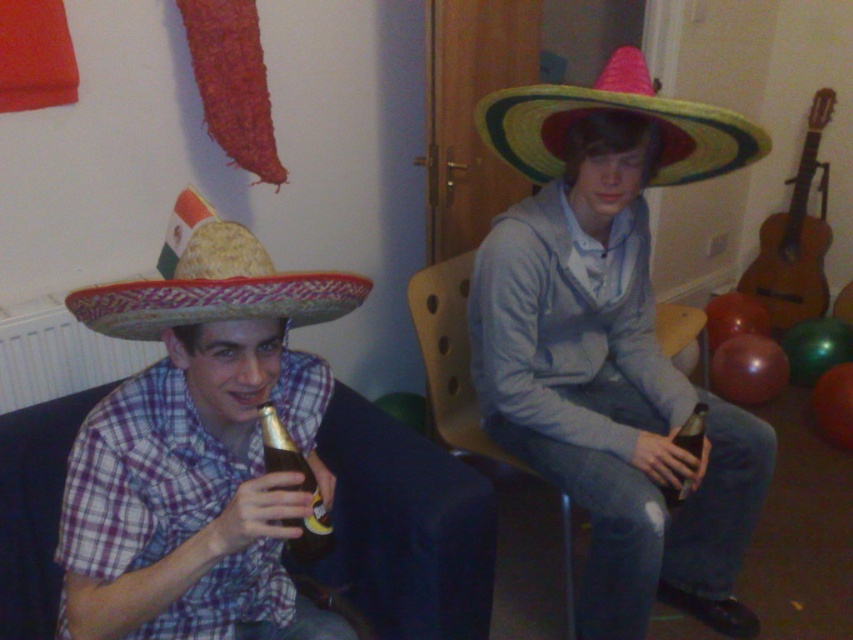
Measure the distance between point [143,301] and camera.

Point [143,301] is 34.87 inches from camera.

Can you confirm if strawhat at left is positioned to the left of multicolored straw sombrero at upper right?

Indeed, strawhat at left is positioned on the left side of multicolored straw sombrero at upper right.

Locate an element on the screen. The width and height of the screenshot is (853, 640). strawhat at left is located at coordinates (212, 282).

The width and height of the screenshot is (853, 640). Identify the location of strawhat at left. (212, 282).

Who is more forward, (607, 493) or (308, 541)?

Positioned in front is point (308, 541).

Is matte gray hoodie at center positioned before brown glass bottle at lower left?

No, matte gray hoodie at center is further to the viewer.

At what (x,y) coordinates should I click in order to perform the action: click on matte gray hoodie at center. Please return your answer as a coordinate pair (x, y). The height and width of the screenshot is (640, 853). Looking at the image, I should click on click(611, 342).

Is plaid fabric shirt at left to the right of wooden chair at center from the viewer's perspective?

Incorrect, plaid fabric shirt at left is not on the right side of wooden chair at center.

Does plaid fabric shirt at left appear on the left side of wooden chair at center?

Correct, you'll find plaid fabric shirt at left to the left of wooden chair at center.

Is point (113, 307) positioned after point (674, 308)?

That is False.

Where is `plaid fabric shirt at left`? plaid fabric shirt at left is located at coordinates (195, 448).